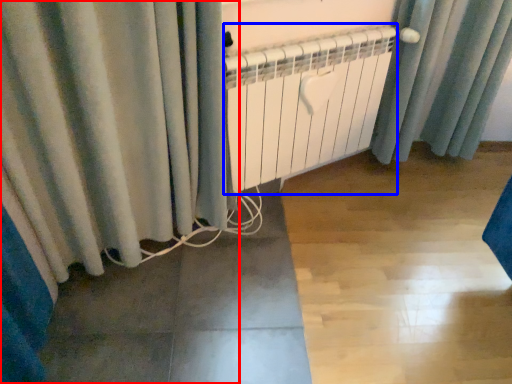
Question: Which point is closer to the camera, curtain (highlighted by a red box) or radiator (highlighted by a blue box)?

Choices:
 (A) curtain
 (B) radiator

Answer: (A)